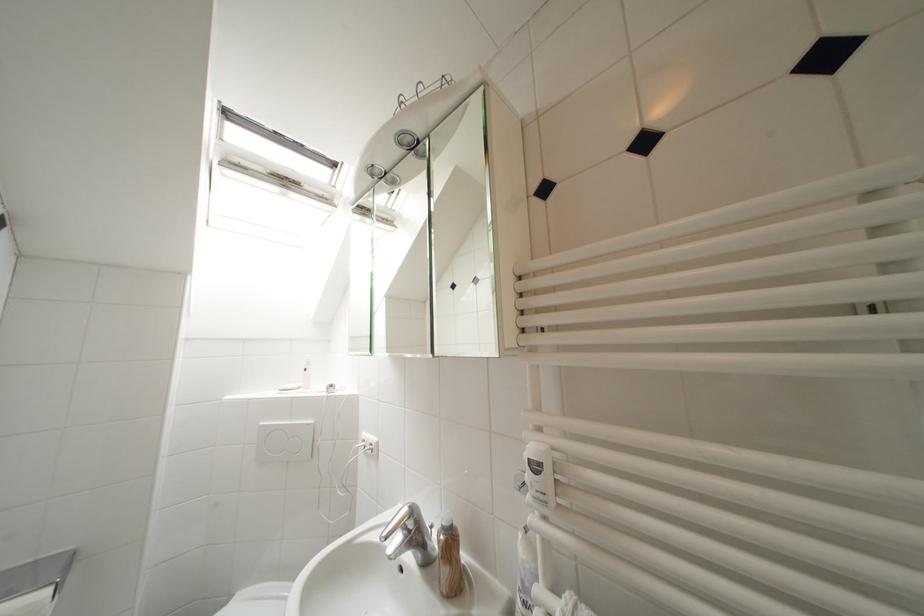
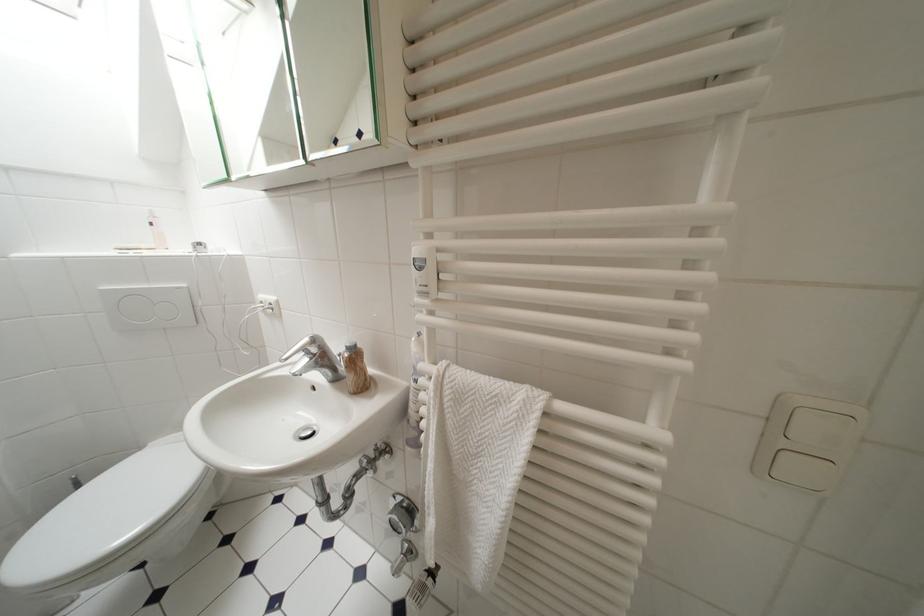
Find the pixel in the second image that matches the point at 311,373 in the first image.

(159, 227)